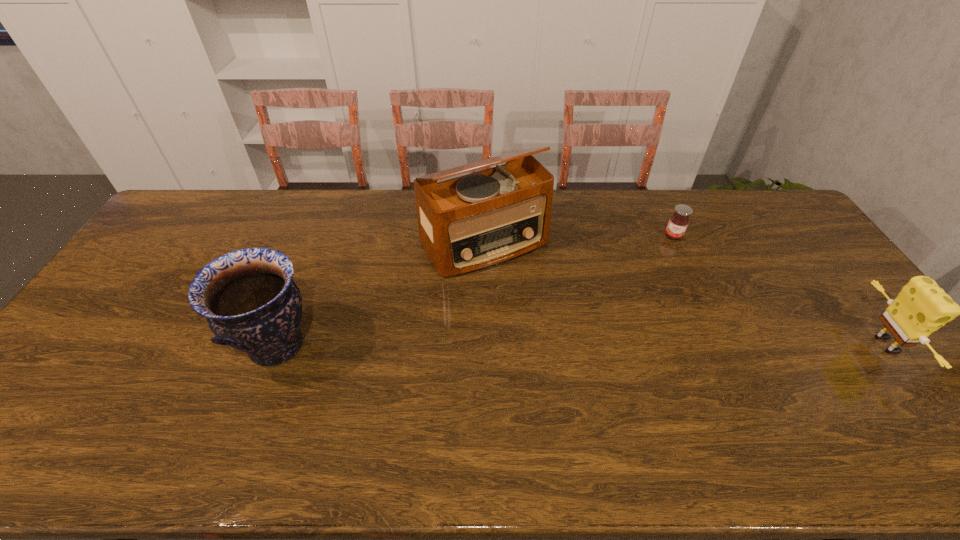
You are a GUI agent. You are given a task and a screenshot of the screen. Output one action in this format:
    pyautogui.click(x=<x>, y=<y>)
    Task: Click on the third shortest object
    This screenshot has width=960, height=540.
    Given the screenshot: What is the action you would take?
    pyautogui.click(x=251, y=303)

Where is `pottery`? This screenshot has width=960, height=540. pottery is located at coordinates (251, 303).

In order to click on the second shortest object in this screenshot , I will do `click(921, 307)`.

I want to click on sponge, so coord(921,307).

Where is `the third object from right to left`? Image resolution: width=960 pixels, height=540 pixels. the third object from right to left is located at coordinates [x=468, y=223].

Image resolution: width=960 pixels, height=540 pixels. What are the coordinates of `radio receiver` in the screenshot? It's located at (468, 223).

Where is `the second object from right to left`? The height and width of the screenshot is (540, 960). the second object from right to left is located at coordinates (679, 221).

You are a GUI agent. You are given a task and a screenshot of the screen. Output one action in this format:
    pyautogui.click(x=<x>, y=<y>)
    Task: Click on the jam
    The height and width of the screenshot is (540, 960).
    Given the screenshot: What is the action you would take?
    pyautogui.click(x=679, y=221)

You are a GUI agent. You are given a task and a screenshot of the screen. Output one action in this format:
    pyautogui.click(x=<x>, y=<y>)
    Task: Click on the free space located on the front handle of the third shortest object
    This screenshot has width=960, height=540.
    Given the screenshot: What is the action you would take?
    pyautogui.click(x=164, y=346)

At what (x,y) coordinates should I click in order to perform the action: click on free location located on the front handle of the third shortest object. Please return your answer as a coordinate pair (x, y). Image resolution: width=960 pixels, height=540 pixels. Looking at the image, I should click on (168, 346).